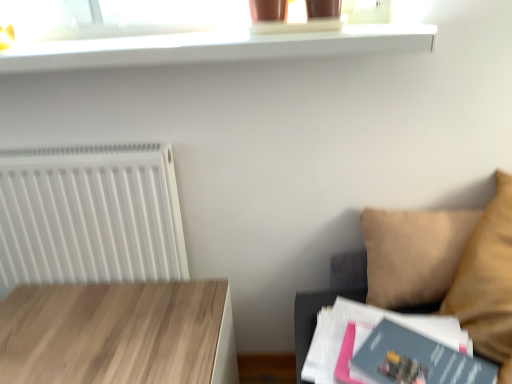
Question: Is light wood table at lower left positioned with its back to white glossy shelf at upper center?

Choices:
 (A) yes
 (B) no

Answer: (B)

Question: Considering the relative sizes of light wood table at lower left and white glossy shelf at upper center in the image provided, is light wood table at lower left taller than white glossy shelf at upper center?

Choices:
 (A) yes
 (B) no

Answer: (A)

Question: Could you tell me if light wood table at lower left is facing white glossy shelf at upper center?

Choices:
 (A) no
 (B) yes

Answer: (A)

Question: Is white glossy shelf at upper center inside light wood table at lower left?

Choices:
 (A) no
 (B) yes

Answer: (A)

Question: Considering the relative positions of light wood table at lower left and white glossy shelf at upper center in the image provided, is light wood table at lower left behind white glossy shelf at upper center?

Choices:
 (A) yes
 (B) no

Answer: (B)

Question: Relative to white plastic radiator at left, is light wood table at lower left in front or behind?

Choices:
 (A) behind
 (B) front

Answer: (B)

Question: Choose the correct answer: Is light wood table at lower left inside white plastic radiator at left or outside it?

Choices:
 (A) inside
 (B) outside

Answer: (B)

Question: Is point (178, 291) positioned closer to the camera than point (52, 258)?

Choices:
 (A) closer
 (B) farther

Answer: (A)

Question: In terms of size, does light wood table at lower left appear bigger or smaller than white plastic radiator at left?

Choices:
 (A) big
 (B) small

Answer: (A)

Question: From the image's perspective, is beige fabric couch at right above or below white plastic radiator at left?

Choices:
 (A) below
 (B) above

Answer: (A)

Question: Considering the positions of beige fabric couch at right and white plastic radiator at left in the image, is beige fabric couch at right wider or thinner than white plastic radiator at left?

Choices:
 (A) wide
 (B) thin

Answer: (A)

Question: Is beige fabric couch at right spatially inside white plastic radiator at left, or outside of it?

Choices:
 (A) outside
 (B) inside

Answer: (A)

Question: Looking at the image, does beige fabric couch at right seem bigger or smaller compared to white plastic radiator at left?

Choices:
 (A) big
 (B) small

Answer: (A)

Question: From the image's perspective, is white glossy shelf at upper center positioned above or below light wood table at lower left?

Choices:
 (A) above
 (B) below

Answer: (A)

Question: Which is correct: white glossy shelf at upper center is inside light wood table at lower left, or outside of it?

Choices:
 (A) outside
 (B) inside

Answer: (A)